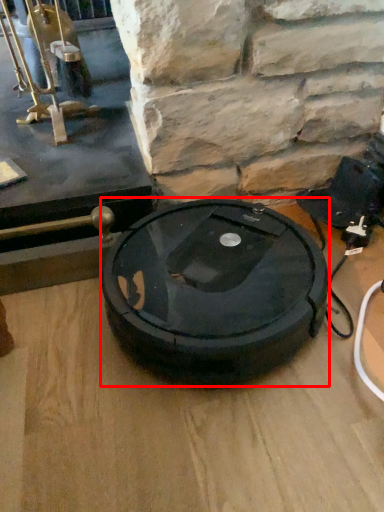
Question: From the image's perspective, where is car tire (annotated by the red box) located relative to table top?

Choices:
 (A) below
 (B) above

Answer: (A)